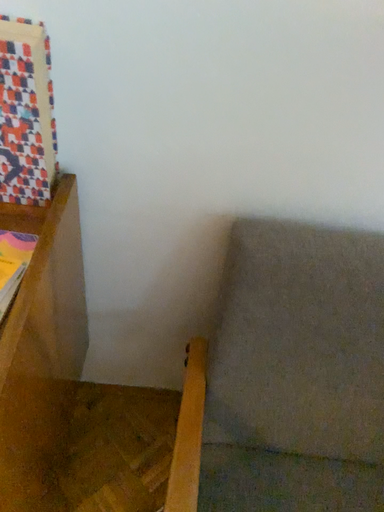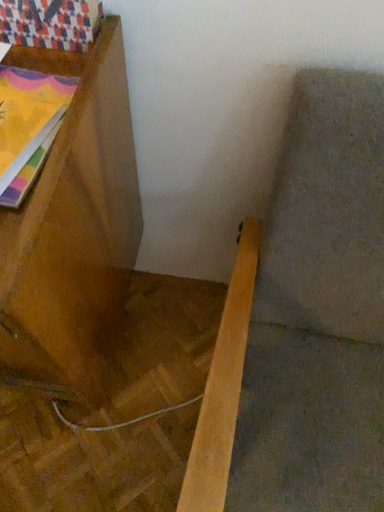
Question: Which way did the camera rotate in the video?

Choices:
 (A) rotated right
 (B) rotated left

Answer: (B)